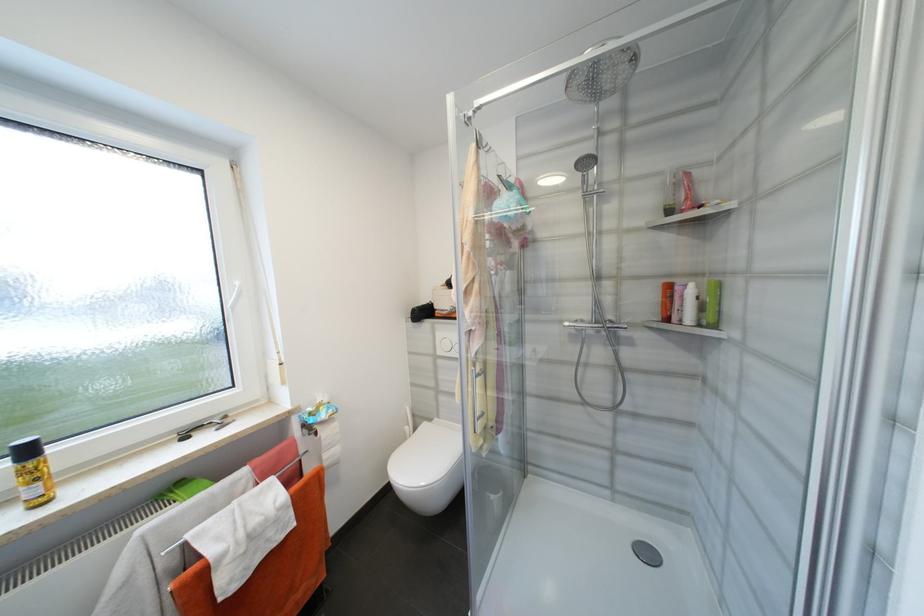
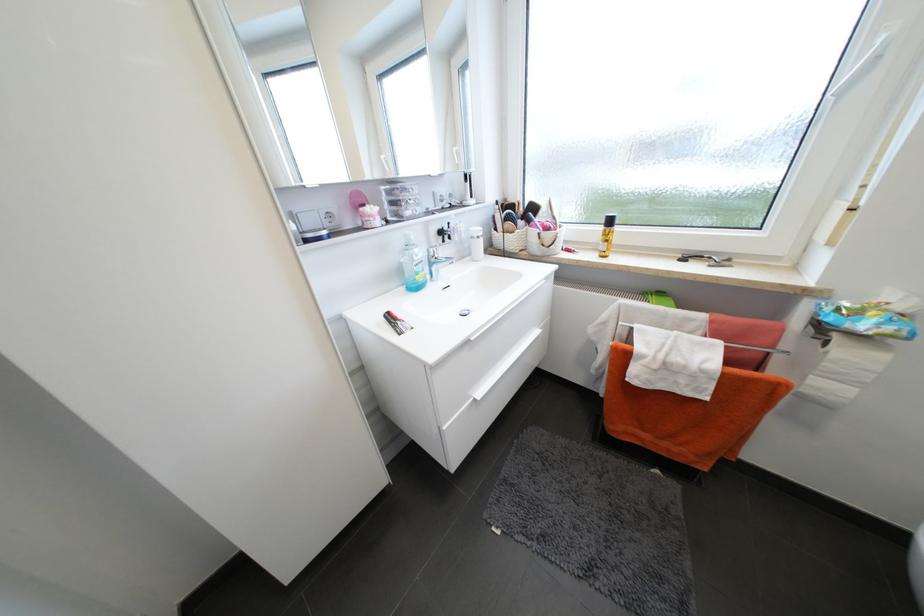
First-person continuous shooting, in which direction is the camera rotating?

The camera's rotation is toward left-down.